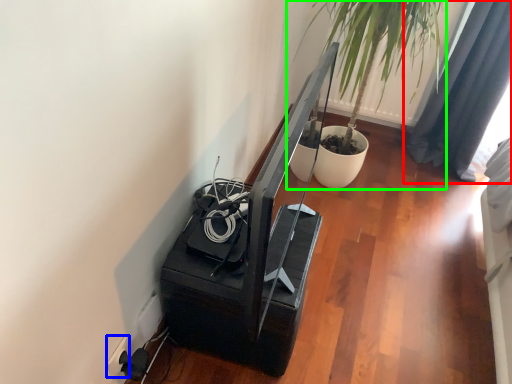
Question: Which object is the farthest from curtain (highlighted by a red box)? Choose among these: electric outlet (highlighted by a blue box) or houseplant (highlighted by a green box).

Choices:
 (A) electric outlet
 (B) houseplant

Answer: (A)